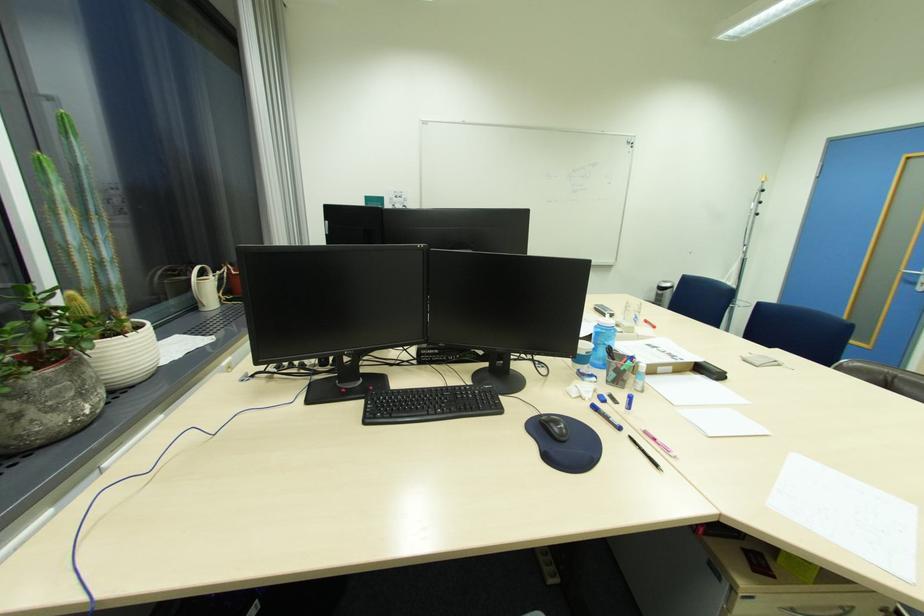
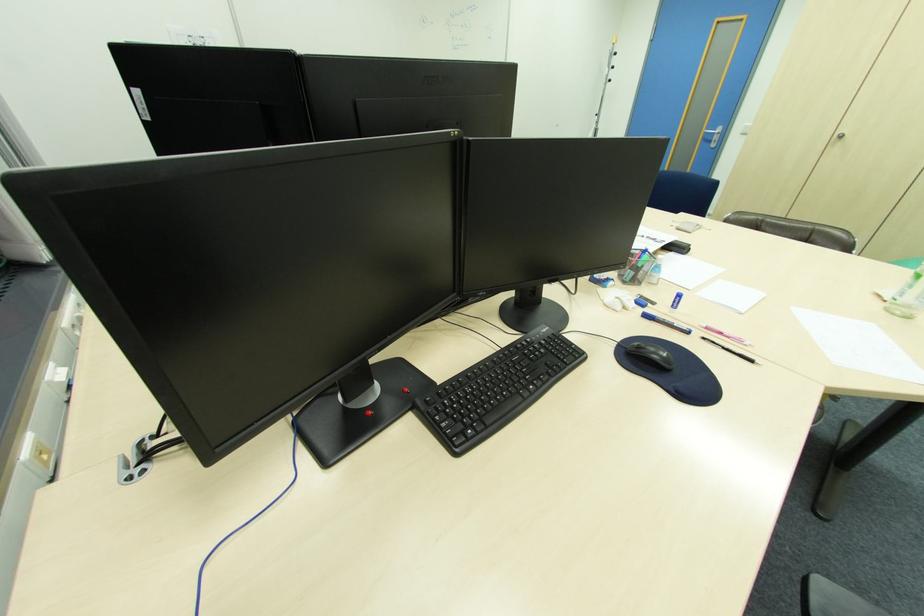
The point at [618,376] is marked in the first image. Where is the corresponding point in the second image?

(637, 274)